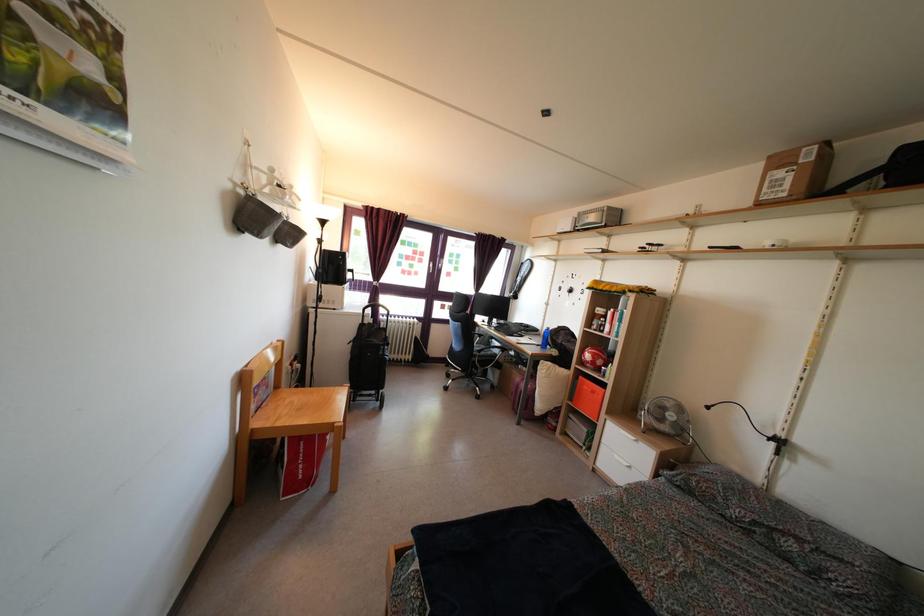
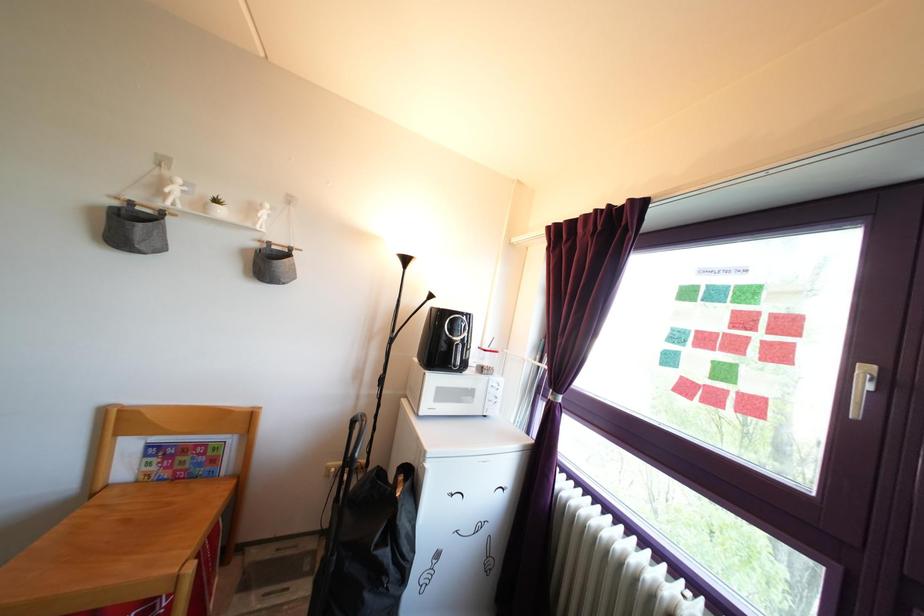
Find the pixel in the second image that matches (420,265) in the first image.

(761, 345)